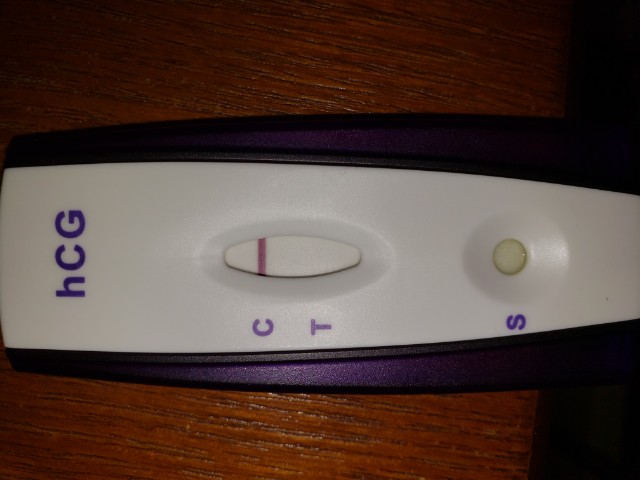
At what (x,y) coordinates should I click in order to perform the action: click on table. Please return your answer as a coordinate pair (x, y). This screenshot has height=480, width=640. Looking at the image, I should click on (82, 300).